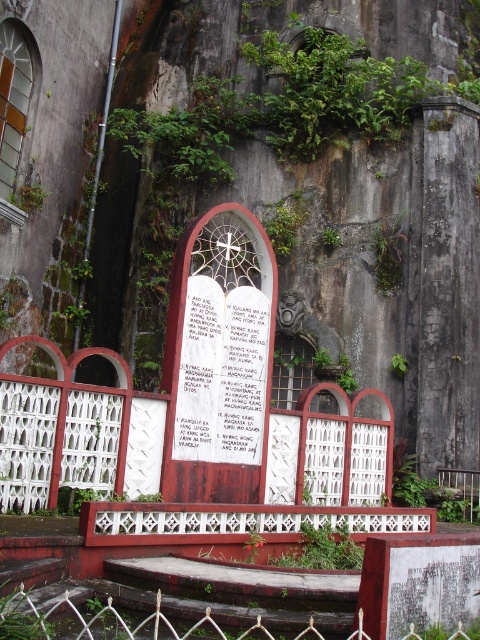
Which is more to the left, white paper at center or white metal fence at lower center?

white paper at center is more to the left.

You are a GUI agent. You are given a task and a screenshot of the screen. Output one action in this format:
    pyautogui.click(x=<x>, y=<y>)
    Task: Click on the white paper at center
    
    Given the screenshot: What is the action you would take?
    pyautogui.click(x=222, y=372)